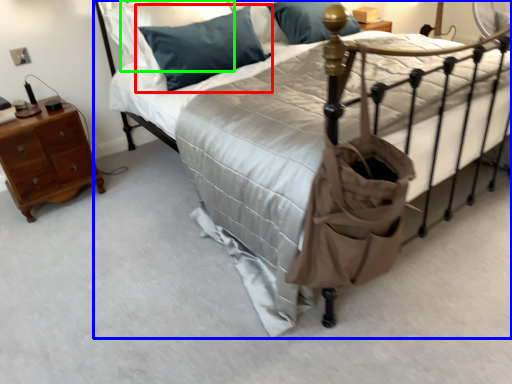
Question: Based on their relative distances, which object is nearer to pillow (highlighted by a red box)? Choose from bed (highlighted by a blue box) and pillow (highlighted by a green box).

Choices:
 (A) bed
 (B) pillow

Answer: (B)